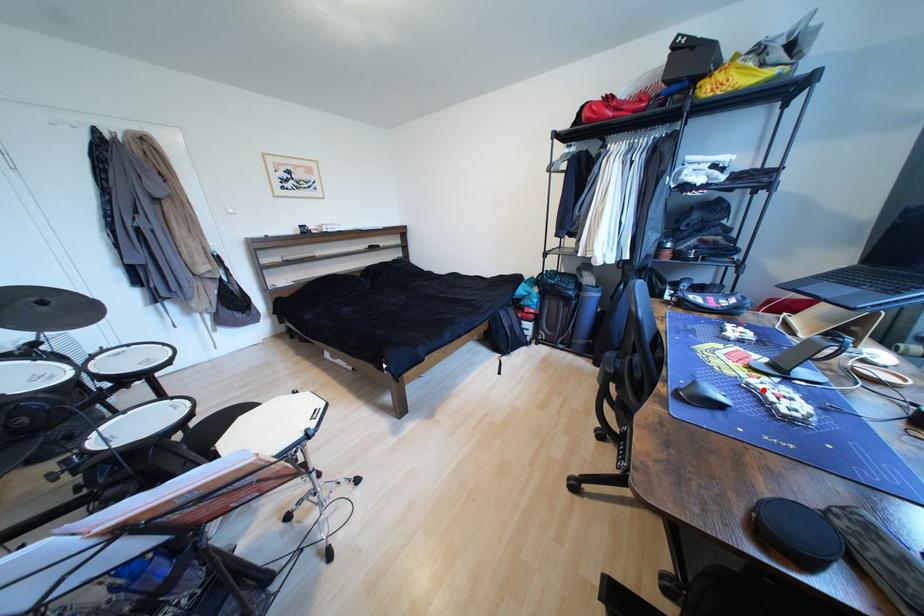
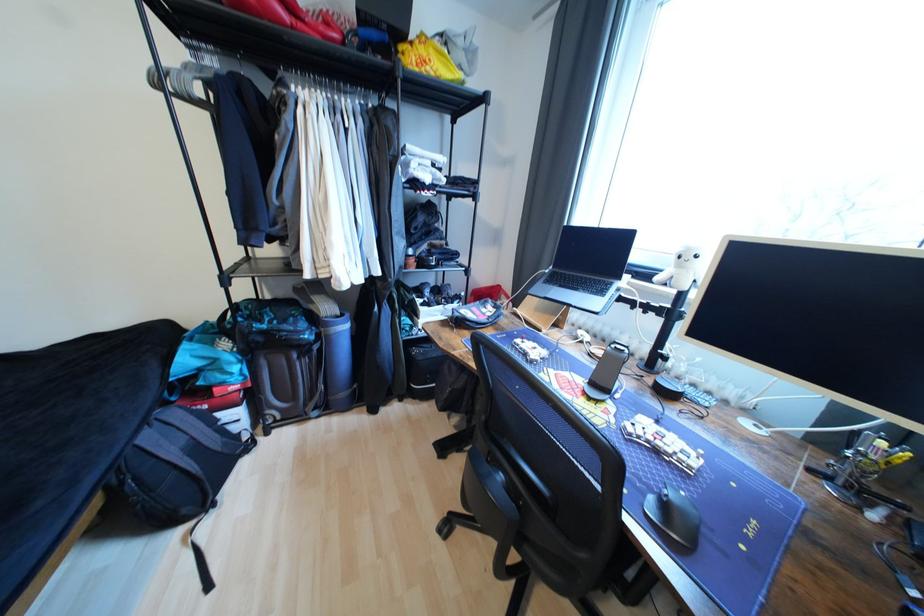
The point at the highlighted location is marked in the first image. Where is the corresponding point in the second image?

(646, 438)